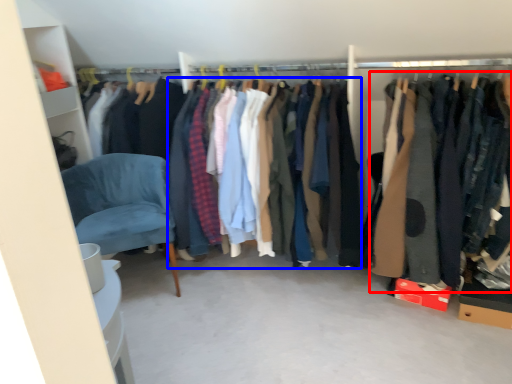
Question: Which object is further to the camera taking this photo, clothing (highlighted by a red box) or clothing (highlighted by a blue box)?

Choices:
 (A) clothing
 (B) clothing

Answer: (B)